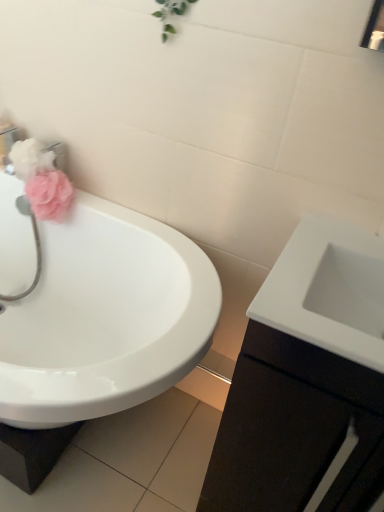
Question: Would you say white glossy sink at right, the first sink when ordered from right to left, is to the left or to the right of matte pink flower at left, the 1th flower from the top, in the picture?

Choices:
 (A) left
 (B) right

Answer: (B)

Question: Relative to matte pink flower at left, the 1th flower from the top, is white glossy sink at right, the second sink in the left-to-right sequence, in front or behind?

Choices:
 (A) behind
 (B) front

Answer: (B)

Question: Based on their relative distances, which object is nearer to the matte pink sponge at left, which ranks as the 1th flower in bottom-to-top order?

Choices:
 (A) pink fabric at left
 (B) white glossy sink at right, the first sink when ordered from right to left
 (C) white glossy cabinet at right
 (D) matte pink flower at left, positioned as the second flower in bottom-to-top order
 (E) white glossy sink at left, the second sink in the right-to-left sequence

Answer: (D)

Question: Estimate the real-world distances between objects in this image. Which object is farther from the matte pink sponge at left, the 2th flower in the top-to-bottom sequence?

Choices:
 (A) white glossy sink at right, the second sink in the left-to-right sequence
 (B) white glossy sink at left, marked as the first sink in a left-to-right arrangement
 (C) white glossy cabinet at right
 (D) matte pink flower at left, positioned as the second flower in bottom-to-top order
 (E) pink fabric at left

Answer: (C)